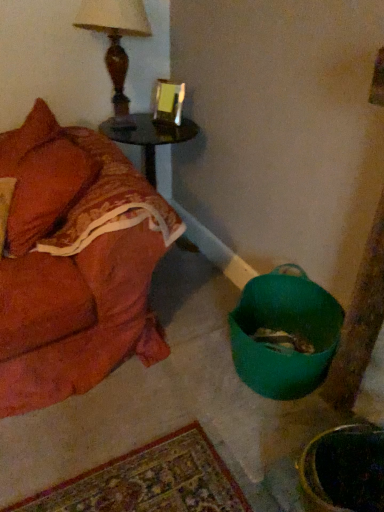
This screenshot has height=512, width=384. Describe the element at coordinates (148, 137) in the screenshot. I see `shiny dark wood side table at upper left` at that location.

This screenshot has height=512, width=384. In order to click on wooden table lamp at upper left in this screenshot , I will do `click(115, 39)`.

The width and height of the screenshot is (384, 512). Find the location of `shiny dark wood side table at upper left`. shiny dark wood side table at upper left is located at coordinates (148, 137).

Is green plastic bucket at lower right aimed at wooden table lamp at upper left?

No.

Considering the positions of point (320, 368) and point (120, 59), is point (320, 368) closer or farther from the camera than point (120, 59)?

Point (320, 368) is positioned closer to the camera compared to point (120, 59).

Is green plastic bucket at lower right not inside wooden table lamp at upper left?

Result: Yes, green plastic bucket at lower right is not within wooden table lamp at upper left.

Identify the location of mixing bowl located in front of the wooden table lamp at upper left. This screenshot has height=512, width=384. (284, 334).

You are a GUI agent. You are given a task and a screenshot of the screen. Output one action in this format:
    pyautogui.click(x=<x>, y=<y>)
    Task: Click on the table below the wooden table lamp at upper left (from a real-world perspective)
    The height and width of the screenshot is (512, 384).
    Given the screenshot: What is the action you would take?
    pyautogui.click(x=148, y=137)

Does wooden table lamp at upper left contain shiny dark wood side table at upper left?

No, shiny dark wood side table at upper left is not inside wooden table lamp at upper left.

Is wooden table lamp at upper left closer to camera compared to shiny dark wood side table at upper left?

Yes, it is in front of shiny dark wood side table at upper left.

Which of these two, velvet orange couch at left or wooden table lamp at upper left, stands taller?

Standing taller between the two is velvet orange couch at left.

From a real-world perspective, who is located lower, velvet orange couch at left or wooden table lamp at upper left?

In real-world perspective, velvet orange couch at left is lower.

Is velvet orange couch at left aimed at wooden table lamp at upper left?

No, velvet orange couch at left is not oriented towards wooden table lamp at upper left.

Based on the photo, from the image's perspective, is velvet orange couch at left located above or below wooden table lamp at upper left?

Clearly, from the image's perspective, velvet orange couch at left is below wooden table lamp at upper left.

In terms of height, does green plastic bucket at lower right look taller or shorter compared to shiny dark wood side table at upper left?

Clearly, green plastic bucket at lower right is shorter compared to shiny dark wood side table at upper left.

From a real-world perspective, between green plastic bucket at lower right and shiny dark wood side table at upper left, who is vertically lower?

green plastic bucket at lower right.

Which object is more forward, green plastic bucket at lower right or shiny dark wood side table at upper left?

Positioned in front is green plastic bucket at lower right.

Considering the relative sizes of shiny dark wood side table at upper left and green plastic bucket at lower right in the image provided, is shiny dark wood side table at upper left shorter than green plastic bucket at lower right?

No.

Does shiny dark wood side table at upper left have a smaller size compared to green plastic bucket at lower right?

No.

Measure the distance from shiny dark wood side table at upper left to green plastic bucket at lower right.

They are 1.04 meters apart.

Considering the relative sizes of shiny dark wood side table at upper left and green plastic bucket at lower right in the image provided, is shiny dark wood side table at upper left thinner than green plastic bucket at lower right?

In fact, shiny dark wood side table at upper left might be wider than green plastic bucket at lower right.

Does velvet orange couch at left touch shiny dark wood side table at upper left?

They are not placed beside each other.

What's the angular difference between velvet orange couch at left and shiny dark wood side table at upper left's facing directions?

They differ by 0.000205 degrees in their facing directions.

From the image's perspective, is velvet orange couch at left located above or below shiny dark wood side table at upper left?

From the image's perspective, velvet orange couch at left appears below shiny dark wood side table at upper left.

From a real-world perspective, which object rests below the other?

shiny dark wood side table at upper left, from a real-world perspective.

Can you tell me how much shiny dark wood side table at upper left and velvet orange couch at left differ in facing direction?

The angle between the facing direction of shiny dark wood side table at upper left and the facing direction of velvet orange couch at left is 0.000205 degrees.

From a real-world perspective, which is physically below, shiny dark wood side table at upper left or velvet orange couch at left?

shiny dark wood side table at upper left.

Which object is thinner, shiny dark wood side table at upper left or velvet orange couch at left?

Thinner between the two is shiny dark wood side table at upper left.

Could you tell me if shiny dark wood side table at upper left is turned towards velvet orange couch at left?

No, shiny dark wood side table at upper left is not oriented towards velvet orange couch at left.

Where is `mixing bowl on the right of wooden table lamp at upper left`? Image resolution: width=384 pixels, height=512 pixels. mixing bowl on the right of wooden table lamp at upper left is located at coordinates (284, 334).

Where is `table that appears below the wooden table lamp at upper left (from the image's perspective)`? table that appears below the wooden table lamp at upper left (from the image's perspective) is located at coordinates (148, 137).

Which object lies nearer to the anchor point wooden table lamp at upper left, velvet orange couch at left or shiny dark wood side table at upper left?

Among the two, shiny dark wood side table at upper left is located nearer to wooden table lamp at upper left.

In the scene shown: Estimate the real-world distances between objects in this image. Which object is further from green plastic bucket at lower right, wooden table lamp at upper left or shiny dark wood side table at upper left?

Among the two, wooden table lamp at upper left is located further to green plastic bucket at lower right.

Consider the image. From the image, which object appears to be farther from wooden table lamp at upper left, shiny dark wood side table at upper left or green plastic bucket at lower right?

green plastic bucket at lower right is further to wooden table lamp at upper left.

Looking at the image, which one is located closer to green plastic bucket at lower right, velvet orange couch at left or shiny dark wood side table at upper left?

velvet orange couch at left lies closer to green plastic bucket at lower right than the other object.

Looking at the image, which one is located further to wooden table lamp at upper left, green plastic bucket at lower right or shiny dark wood side table at upper left?

green plastic bucket at lower right lies further to wooden table lamp at upper left than the other object.

Estimate the real-world distances between objects in this image. Which object is closer to wooden table lamp at upper left, shiny dark wood side table at upper left or velvet orange couch at left?

shiny dark wood side table at upper left is closer to wooden table lamp at upper left.

From the image, which object appears to be nearer to velvet orange couch at left, green plastic bucket at lower right or wooden table lamp at upper left?

green plastic bucket at lower right.

Estimate the real-world distances between objects in this image. Which object is further from velvet orange couch at left, wooden table lamp at upper left or green plastic bucket at lower right?

wooden table lamp at upper left.

The image size is (384, 512). In order to click on table lamp between velvet orange couch at left and shiny dark wood side table at upper left along the z-axis in this screenshot , I will do `click(115, 39)`.

You are a GUI agent. You are given a task and a screenshot of the screen. Output one action in this format:
    pyautogui.click(x=<x>, y=<y>)
    Task: Click on the table between velvet orange couch at left and green plastic bucket at lower right in the horizontal direction
    
    Given the screenshot: What is the action you would take?
    pyautogui.click(x=148, y=137)

At what (x,y) coordinates should I click in order to perform the action: click on table between wooden table lamp at upper left and green plastic bucket at lower right vertically. Please return your answer as a coordinate pair (x, y). This screenshot has height=512, width=384. Looking at the image, I should click on (148, 137).

Locate an element on the screen. The height and width of the screenshot is (512, 384). studio couch between wooden table lamp at upper left and green plastic bucket at lower right from top to bottom is located at coordinates coord(75,263).